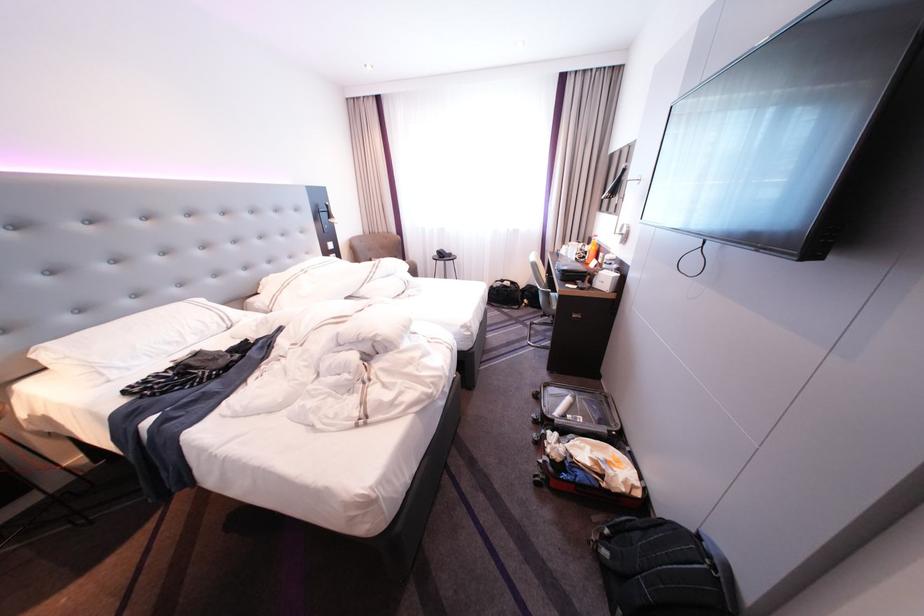
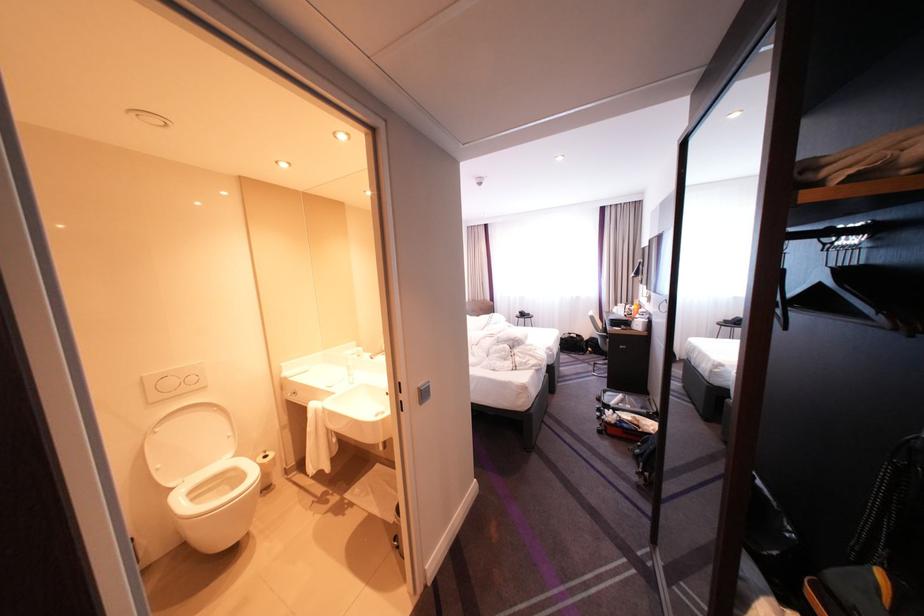
In the second image, find the point that corresponds to (591,244) in the first image.

(638, 305)